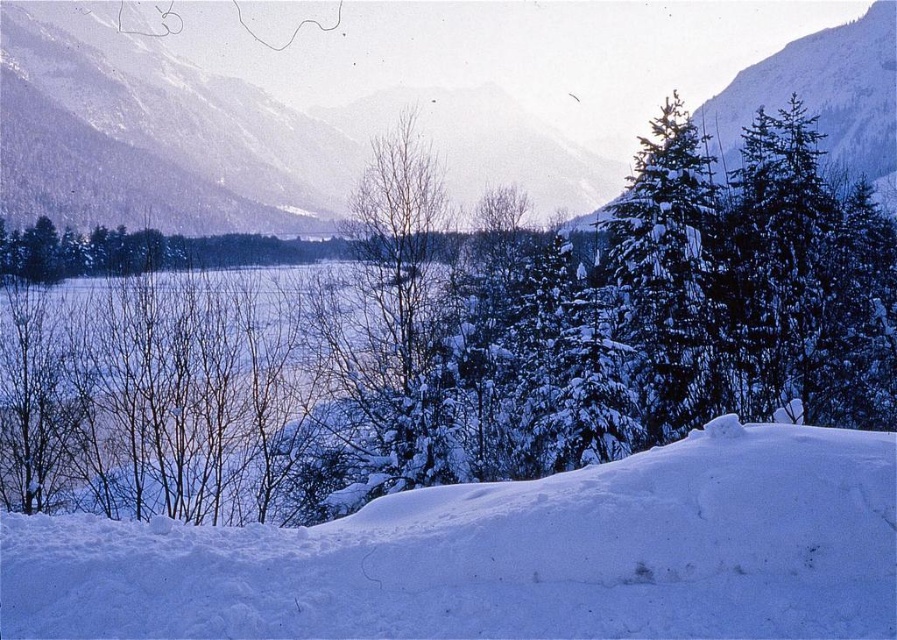
Based on the coordinates provided in the description, where is the snowy mountain at upper center positioned in the image?

The snowy mountain at upper center is located at point coordinates (x=234, y=138).